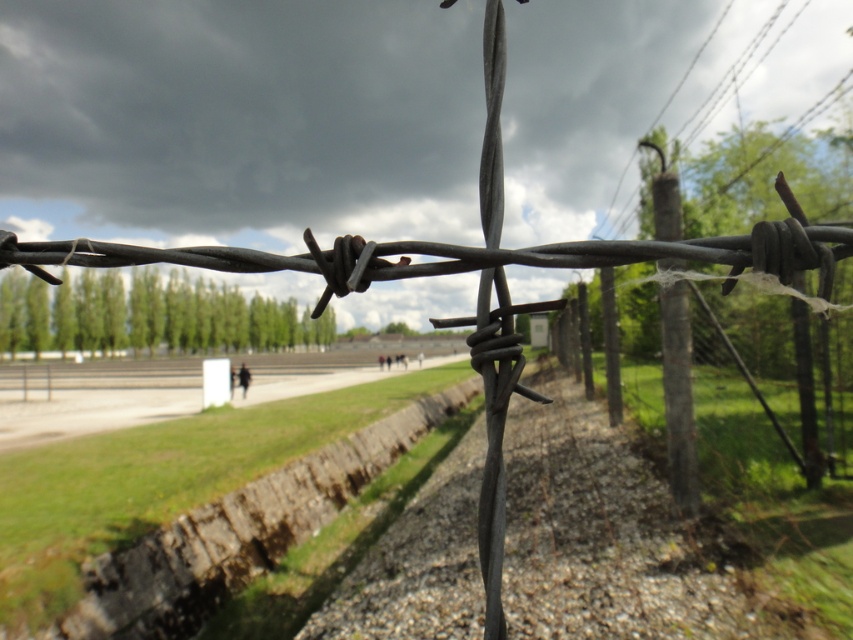
Question: Can you confirm if rusty concrete trench at center is smaller than rusty wire fence at center?

Choices:
 (A) yes
 (B) no

Answer: (A)

Question: Is rusty concrete trench at center smaller than rusty wire fence at center?

Choices:
 (A) yes
 (B) no

Answer: (A)

Question: Which of the following is the closest to the observer?

Choices:
 (A) rusty concrete trench at center
 (B) rusty wire fence at center

Answer: (B)

Question: Does rusty concrete trench at center have a lesser width compared to rusty wire fence at center?

Choices:
 (A) no
 (B) yes

Answer: (B)